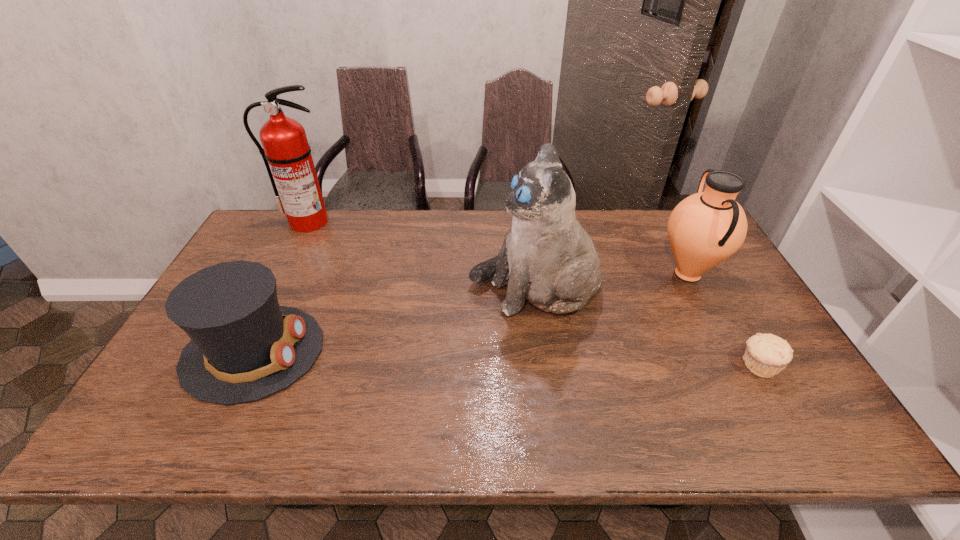
At what (x,y) coordinates should I click in order to perform the action: click on free point located 0.380m with goggles on the front of the fourth tallest object. Please return your answer as a coordinate pair (x, y). The image size is (960, 540). Looking at the image, I should click on (470, 352).

Find the location of a particular element. This screenshot has height=540, width=960. free space located 0.370m on the back of the shortest object is located at coordinates (697, 259).

Identify the location of fire extinguisher at the far edge. This screenshot has height=540, width=960. (286, 153).

Identify the location of pitcher at the far edge. (704, 229).

I want to click on fire extinguisher located at the left edge, so click(x=286, y=153).

Where is `dress hat situated at the left edge`? The image size is (960, 540). dress hat situated at the left edge is located at coordinates (244, 347).

The width and height of the screenshot is (960, 540). I want to click on pitcher that is positioned at the right edge, so click(704, 229).

This screenshot has height=540, width=960. I want to click on muffin located in the right edge section of the desktop, so click(766, 355).

Find the location of `object located at the far left corner`. object located at the far left corner is located at coordinates (286, 153).

Identify the location of object that is positioned at the far right corner. The image size is (960, 540). click(704, 229).